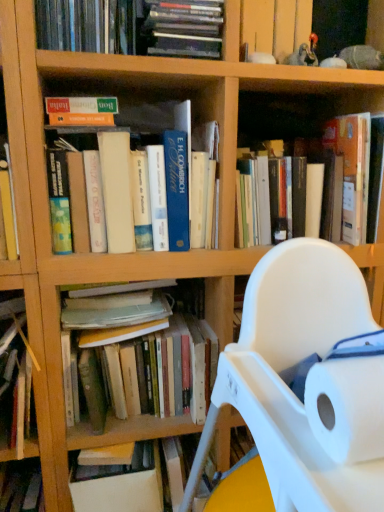
This screenshot has width=384, height=512. In order to click on hardcover books at upper center, the first book positioned from the top in this screenshot , I will do `click(184, 28)`.

Measure the distance between wooden shelf at upper right and camera.

wooden shelf at upper right is 32.78 inches away from camera.

How much space does hardcover books at upper left, which appears as the third book when ordered from the bottom, occupy horizontally?

11.94 inches.

Image resolution: width=384 pixels, height=512 pixels. What do you see at coordinates (81, 111) in the screenshot?
I see `matte green book at upper left, placed as the fifth book when sorted from bottom to top` at bounding box center [81, 111].

What do you see at coordinates (347, 407) in the screenshot? The image size is (384, 512). I see `white paper at right` at bounding box center [347, 407].

Find the location of a particular element. This screenshot has width=384, height=512. white paper at right is located at coordinates (347, 407).

Identify the location of hardcover book at lower left, which is the second book in bottom-to-top order. This screenshot has height=512, width=384. (18, 325).

Which of these two, wooden shelf at upper right or hardcover books at upper left, which appears as the third book when ordered from the bottom, stands shorter?

wooden shelf at upper right.

Does point (258, 21) appear closer or farther from the camera than point (183, 208)?

Point (258, 21) is positioned farther from the camera compared to point (183, 208).

Where is `the 3rd book in front of the wooden shelf at upper right, starting your count from the anchor`? the 3rd book in front of the wooden shelf at upper right, starting your count from the anchor is located at coordinates (154, 190).

Are wooden shelf at upper right and hardcover books at upper left, arranged as the 4th book when viewed from the top, located far from each other?

wooden shelf at upper right is near hardcover books at upper left, arranged as the 4th book when viewed from the top, not far away.

Is white plastic chair at center at the back of hardcover book at lower left, which is the second book in bottom-to-top order?

No.

From the image's perspective, is hardcover book at lower left, marked as the fifth book in a top-to-bottom arrangement, beneath white plastic chair at center?

No, from the image's perspective, hardcover book at lower left, marked as the fifth book in a top-to-bottom arrangement, is not below white plastic chair at center.

From a real-world perspective, which object stands above the other?

hardcover book at lower left, which is the second book in bottom-to-top order.

Considering the relative sizes of hardcover book at lower left, marked as the fifth book in a top-to-bottom arrangement, and white plastic chair at center in the image provided, is hardcover book at lower left, marked as the fifth book in a top-to-bottom arrangement, thinner than white plastic chair at center?

Indeed, hardcover book at lower left, marked as the fifth book in a top-to-bottom arrangement, has a lesser width compared to white plastic chair at center.

From a real-world perspective, is hardcover book at lower left, marked as the fifth book in a top-to-bottom arrangement, located beneath wooden shelf at upper right?

Yes, from a real-world perspective, hardcover book at lower left, marked as the fifth book in a top-to-bottom arrangement, is beneath wooden shelf at upper right.

Is hardcover book at lower left, marked as the fifth book in a top-to-bottom arrangement, in front of or behind wooden shelf at upper right in the image?

In the image, hardcover book at lower left, marked as the fifth book in a top-to-bottom arrangement, appears in front of wooden shelf at upper right.

Choose the correct answer: Is hardcover book at lower left, marked as the fifth book in a top-to-bottom arrangement, inside wooden shelf at upper right or outside it?

hardcover book at lower left, marked as the fifth book in a top-to-bottom arrangement, is spatially situated outside wooden shelf at upper right.

Considering the sizes of objects hardcover book at lower left, which is the second book in bottom-to-top order, and wooden shelf at upper right in the image provided, who is bigger, hardcover book at lower left, which is the second book in bottom-to-top order, or wooden shelf at upper right?

With larger size is wooden shelf at upper right.

From the image's perspective, is wooden shelf at upper right positioned above or below hardcover book at lower left, which is the second book in bottom-to-top order?

wooden shelf at upper right is above hardcover book at lower left, which is the second book in bottom-to-top order.

Does wooden shelf at upper right touch hardcover book at lower left, which is the second book in bottom-to-top order?

No.

From a real-world perspective, who is located higher, wooden shelf at upper right or hardcover book at lower left, which is the second book in bottom-to-top order?

From a 3D spatial view, wooden shelf at upper right is above.

How different are the orientations of hardcover book at center, the fourth book ordered from the bottom, and hardcover books at upper left, arranged as the 4th book when viewed from the top, in degrees?

0.00034 degrees.

Is hardcover book at center, the 3th book positioned from the top, wider than hardcover books at upper left, which appears as the third book when ordered from the bottom?

Yes.

Does point (360, 167) appear closer or farther from the camera than point (152, 200)?

Point (360, 167) is positioned farther from the camera compared to point (152, 200).

From the image's perspective, which is below, hardcover book at center, the 3th book positioned from the top, or hardcover books at upper left, which appears as the third book when ordered from the bottom?

hardcover books at upper left, which appears as the third book when ordered from the bottom, is shown below in the image.

Considering the positions of points (301, 32) and (364, 129), is point (301, 32) closer to camera compared to point (364, 129)?

No, it is behind (364, 129).

Can you tell me how much wooden shelf at upper right and hardcover book at center, the 3th book positioned from the top, differ in facing direction?

The angle between the facing direction of wooden shelf at upper right and the facing direction of hardcover book at center, the 3th book positioned from the top, is 0.00133 degrees.

Considering the sizes of objects wooden shelf at upper right and hardcover book at center, the fourth book ordered from the bottom, in the image provided, who is bigger, wooden shelf at upper right or hardcover book at center, the fourth book ordered from the bottom,?

hardcover book at center, the fourth book ordered from the bottom.

How different are the orientations of hardcover books at upper center, the first book positioned from the top, and white paper at right in degrees?

1.32 degrees separate the facing orientations of hardcover books at upper center, the first book positioned from the top, and white paper at right.

Which of these two, hardcover books at upper center, the 6th book from the bottom, or white paper at right, is thinner?

With smaller width is white paper at right.

Considering the points (209, 22) and (328, 404), which point is behind, point (209, 22) or point (328, 404)?

The point (209, 22) is more distant.

Is hardcover books at upper center, the first book positioned from the top, to the left or to the right of white paper at right in the image?

Based on their positions, hardcover books at upper center, the first book positioned from the top, is located to the left of white paper at right.

Find the location of a particular element. shelf above the hardcover books at upper left, which appears as the third book when ordered from the bottom (from the image's perspective) is located at coordinates (275, 24).

Find the location of `the 4th book behind the white plastic chair at center, counting from the anchor's position`. the 4th book behind the white plastic chair at center, counting from the anchor's position is located at coordinates (18, 325).

Which object lies nearer to the anchor point hardcover books at center, acting as the 1th book starting from the bottom, white paper at right or hardcover books at upper center, the first book positioned from the top?

white paper at right is positioned closer to the anchor hardcover books at center, acting as the 1th book starting from the bottom.

Considering their positions, is wooden shelf at upper right positioned further to white plastic chair at center than hardcover book at center, the fourth book ordered from the bottom?

wooden shelf at upper right.

From the image, which object appears to be farther from matte green book at upper left, which is counted as the second book, starting from the top, white plastic chair at center or white paper at right?

Based on the image, white paper at right appears to be further to matte green book at upper left, which is counted as the second book, starting from the top.

Estimate the real-world distances between objects in this image. Which object is closer to hardcover book at center, the 3th book positioned from the top, hardcover books at upper left, which appears as the third book when ordered from the bottom, or hardcover book at lower left, which is the second book in bottom-to-top order?

hardcover books at upper left, which appears as the third book when ordered from the bottom, is positioned closer to the anchor hardcover book at center, the 3th book positioned from the top.

Estimate the real-world distances between objects in this image. Which object is further from wooden shelf at upper right, hardcover book at lower left, marked as the fifth book in a top-to-bottom arrangement, or white plastic chair at center?

hardcover book at lower left, marked as the fifth book in a top-to-bottom arrangement, is further to wooden shelf at upper right.

Based on their spatial positions, is hardcover books at upper left, which appears as the third book when ordered from the bottom, or white paper at right further from hardcover books at upper center, the first book positioned from the top?

Based on the image, white paper at right appears to be further to hardcover books at upper center, the first book positioned from the top.

Considering their positions, is white plastic chair at center positioned further to hardcover books at upper center, the first book positioned from the top, than hardcover book at center, the 3th book positioned from the top?

Among the two, white plastic chair at center is located further to hardcover books at upper center, the first book positioned from the top.

Based on their spatial positions, is white plastic chair at center or hardcover books at upper left, arranged as the 4th book when viewed from the top, closer to hardcover book at center, the fourth book ordered from the bottom?

Among the two, white plastic chair at center is located nearer to hardcover book at center, the fourth book ordered from the bottom.

Find the location of `paper towel between hardcover books at upper left, arranged as the 4th book when viewed from the top, and white plastic chair at center in the up-down direction`. paper towel between hardcover books at upper left, arranged as the 4th book when viewed from the top, and white plastic chair at center in the up-down direction is located at coordinates (347, 407).

Locate an element on the screen. book between hardcover books at upper left, arranged as the 4th book when viewed from the top, and hardcover books at center, the 6th book from the top, in the vertical direction is located at coordinates (18, 325).

This screenshot has height=512, width=384. In order to click on paper towel between hardcover books at upper center, the first book positioned from the top, and hardcover books at center, the 6th book from the top, in the up-down direction in this screenshot , I will do `click(347, 407)`.

I want to click on paper towel that lies between hardcover books at upper center, the first book positioned from the top, and hardcover book at lower left, marked as the fifth book in a top-to-bottom arrangement, from top to bottom, so click(347, 407).